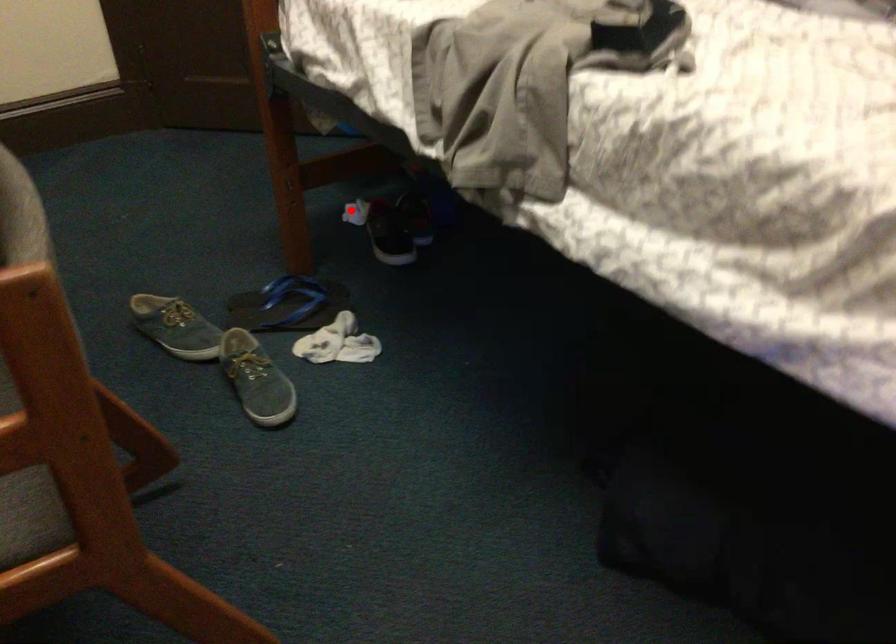
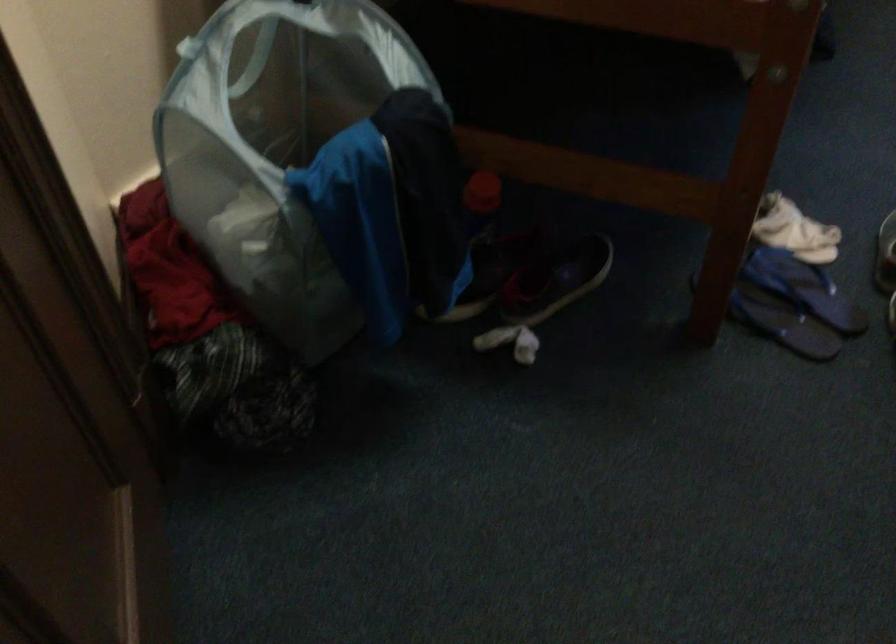
Question: A red point is marked in image1. In image2, is the corresponding 3D point closer to the camera or farther? Reply with the corresponding letter.

Choices:
 (A) The corresponding 3D point is closer.
 (B) The corresponding 3D point is farther.

Answer: (A)